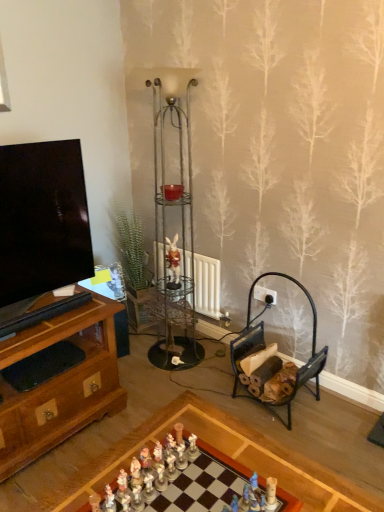
Locate an element on the screen. The height and width of the screenshot is (512, 384). vacant space behind shiny silver chess piece at center, marked as the 3th toy in a right-to-left arrangement is located at coordinates point(170,430).